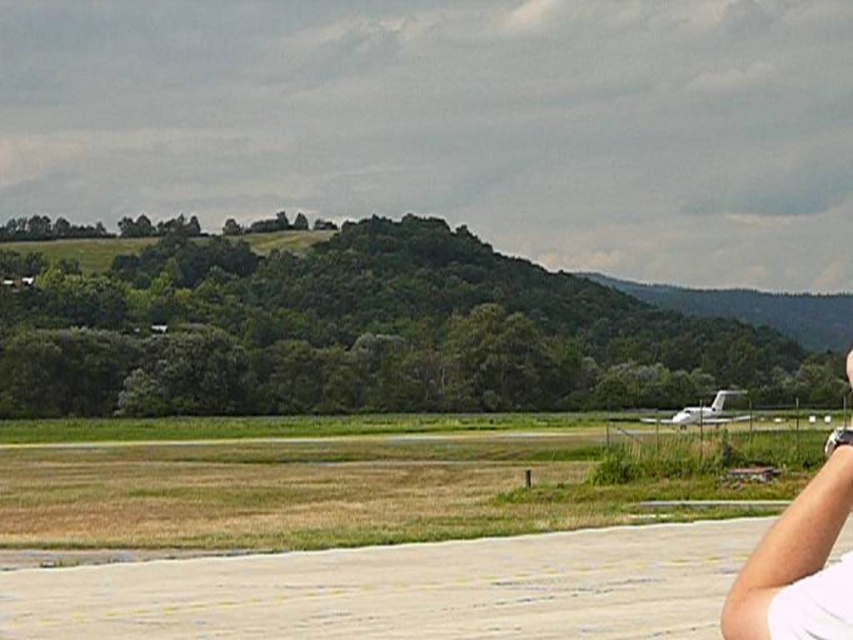
Is white smooth tarmac at lower center shorter than white glossy airplane at lower right?

Incorrect, white smooth tarmac at lower center's height does not fall short of white glossy airplane at lower right's.

Is white smooth tarmac at lower center wider than white glossy airplane at lower right?

No, white smooth tarmac at lower center is not wider than white glossy airplane at lower right.

Does point (408, 621) come in front of point (680, 422)?

Yes, point (408, 621) is in front of point (680, 422).

Locate an element on the screen. This screenshot has width=853, height=640. white smooth tarmac at lower center is located at coordinates (402, 589).

Who is taller, white fabric at lower right or white glossy airplane at lower right?

white fabric at lower right

Measure the distance from white fabric at lower right to white glossy airplane at lower right.

white fabric at lower right and white glossy airplane at lower right are 30.44 meters apart from each other.

What are the coordinates of `white fabric at lower right` in the screenshot? It's located at (798, 564).

Between point (706, 545) and point (805, 522), which one is positioned in front?

Point (805, 522) is in front.

This screenshot has height=640, width=853. I want to click on white smooth tarmac at lower center, so click(402, 589).

Is point (410, 614) positioned before point (790, 580)?

No.

The image size is (853, 640). In order to click on white smooth tarmac at lower center in this screenshot , I will do `click(402, 589)`.